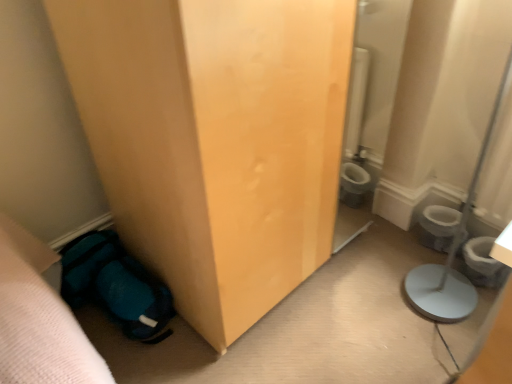
Measure the distance between white glossy toilet bowl at lower right and camera.

white glossy toilet bowl at lower right and camera are 1.40 meters apart from each other.

Measure the distance between point (459, 211) and camera.

They are 1.57 meters apart.

What do you see at coordinates (116, 285) in the screenshot? I see `teal fabric sleeping bag at lower left` at bounding box center [116, 285].

Describe the element at coordinates (483, 263) in the screenshot. I see `white plastic potty at lower right` at that location.

This screenshot has width=512, height=384. I want to click on white glossy toilet bowl at lower right, so click(438, 227).

Is white plastic potty at lower right further to the viewer compared to white glossy toilet bowl at lower right?

No, it is not.

Based on the photo, is white plastic potty at lower right facing towards white glossy toilet bowl at lower right?

Yes, white plastic potty at lower right is aimed at white glossy toilet bowl at lower right.

Is white plastic potty at lower right taller or shorter than white glossy toilet bowl at lower right?

Considering their sizes, white plastic potty at lower right has less height than white glossy toilet bowl at lower right.

From the image's perspective, which one is positioned higher, white plastic potty at lower right or white glossy toilet bowl at lower right?

white glossy toilet bowl at lower right appears higher in the image.

Is white glossy toilet bowl at lower right turned away from white plastic potty at lower right?

That's right, white glossy toilet bowl at lower right is facing away from white plastic potty at lower right.

Between white glossy toilet bowl at lower right and white plastic potty at lower right, which one has smaller width?

Thinner between the two is white plastic potty at lower right.

This screenshot has width=512, height=384. Identify the location of potty positioned vertically above the white glossy toilet bowl at lower right (from a real-world perspective). (483, 263).

From the image's perspective, does white glossy toilet bowl at lower right appear higher than white plastic potty at lower right?

Yes.

Between teal fabric sleeping bag at lower left and white plastic potty at lower right, which one has more height?

teal fabric sleeping bag at lower left.

Which object is further away from the camera, teal fabric sleeping bag at lower left or white plastic potty at lower right?

Positioned behind is white plastic potty at lower right.

Locate an element on the screen. potty directly beneath the teal fabric sleeping bag at lower left (from a real-world perspective) is located at coordinates (483, 263).

Consider the image. From a real-world perspective, relative to white plastic potty at lower right, is teal fabric sleeping bag at lower left vertically above or below?

teal fabric sleeping bag at lower left is above white plastic potty at lower right.

What's the angular difference between white plastic potty at lower right and teal fabric sleeping bag at lower left's facing directions?

4.72 degrees separate the facing orientations of white plastic potty at lower right and teal fabric sleeping bag at lower left.

Which point is more forward, (x=483, y=253) or (x=80, y=253)?

The point (x=80, y=253) is closer.

Is teal fabric sleeping bag at lower left at the back of white plastic potty at lower right?

No, white plastic potty at lower right is not facing the opposite direction of teal fabric sleeping bag at lower left.

Can you confirm if white plastic potty at lower right is positioned to the left of teal fabric sleeping bag at lower left?

No.

Could you tell me if teal fabric sleeping bag at lower left is turned towards white glossy toilet bowl at lower right?

No, teal fabric sleeping bag at lower left is not oriented towards white glossy toilet bowl at lower right.

Is teal fabric sleeping bag at lower left to the left of white glossy toilet bowl at lower right from the viewer's perspective?

Yes, teal fabric sleeping bag at lower left is to the left of white glossy toilet bowl at lower right.

Which object is closer to the camera taking this photo, teal fabric sleeping bag at lower left or white glossy toilet bowl at lower right?

Positioned in front is teal fabric sleeping bag at lower left.

Does teal fabric sleeping bag at lower left have a larger size compared to white glossy toilet bowl at lower right?

Correct, teal fabric sleeping bag at lower left is larger in size than white glossy toilet bowl at lower right.

The width and height of the screenshot is (512, 384). Find the location of `toilet bowl that is on the right side of teal fabric sleeping bag at lower left`. toilet bowl that is on the right side of teal fabric sleeping bag at lower left is located at coordinates (438, 227).

Would you say white glossy toilet bowl at lower right is to the left or to the right of teal fabric sleeping bag at lower left in the picture?

Clearly, white glossy toilet bowl at lower right is on the right of teal fabric sleeping bag at lower left in the image.

Does point (433, 217) come closer to viewer compared to point (142, 335)?

No, (433, 217) is further to viewer.

Can you confirm if white glossy toilet bowl at lower right is bigger than teal fabric sleeping bag at lower left?

Incorrect, white glossy toilet bowl at lower right is not larger than teal fabric sleeping bag at lower left.

Where is `potty that appears on the right of white glossy toilet bowl at lower right`? This screenshot has width=512, height=384. potty that appears on the right of white glossy toilet bowl at lower right is located at coordinates (483, 263).

Identify the location of potty lying in front of the white glossy toilet bowl at lower right. (483, 263).

Looking at the image, which one is located closer to teal fabric sleeping bag at lower left, white plastic potty at lower right or white glossy toilet bowl at lower right?

white glossy toilet bowl at lower right lies closer to teal fabric sleeping bag at lower left than the other object.

From the image, which object appears to be nearer to white plastic potty at lower right, teal fabric sleeping bag at lower left or white glossy toilet bowl at lower right?

white glossy toilet bowl at lower right lies closer to white plastic potty at lower right than the other object.

Consider the image. From the image, which object appears to be nearer to white plastic potty at lower right, white glossy toilet bowl at lower right or teal fabric sleeping bag at lower left?

Based on the image, white glossy toilet bowl at lower right appears to be nearer to white plastic potty at lower right.

Estimate the real-world distances between objects in this image. Which object is closer to teal fabric sleeping bag at lower left, white glossy toilet bowl at lower right or white plastic potty at lower right?

Based on the image, white glossy toilet bowl at lower right appears to be nearer to teal fabric sleeping bag at lower left.

Looking at the image, which one is located further to white glossy toilet bowl at lower right, white plastic potty at lower right or teal fabric sleeping bag at lower left?

teal fabric sleeping bag at lower left.

Which object lies nearer to the anchor point white glossy toilet bowl at lower right, teal fabric sleeping bag at lower left or white plastic potty at lower right?

white plastic potty at lower right is closer to white glossy toilet bowl at lower right.

Locate an element on the screen. The height and width of the screenshot is (384, 512). toilet bowl between teal fabric sleeping bag at lower left and white plastic potty at lower right in the horizontal direction is located at coordinates (438, 227).